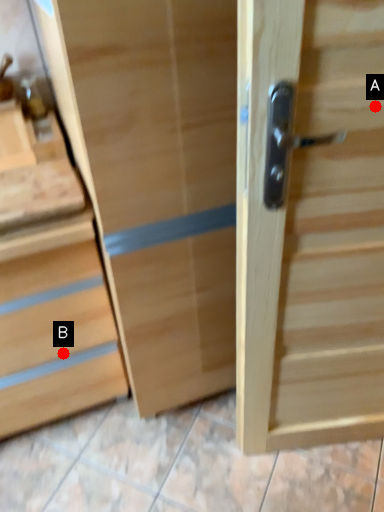
Question: Two points are circled on the image, labeled by A and B beside each circle. Which point appears farthest from the camera in this image?

Choices:
 (A) A is further
 (B) B is further

Answer: (B)